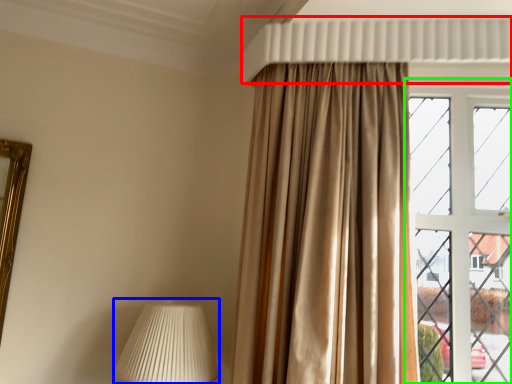
Question: Considering the real-world distances, which object is farthest from shutter (highlighted by a red box)? table lamp (highlighted by a blue box) or window (highlighted by a green box)?

Choices:
 (A) table lamp
 (B) window

Answer: (A)